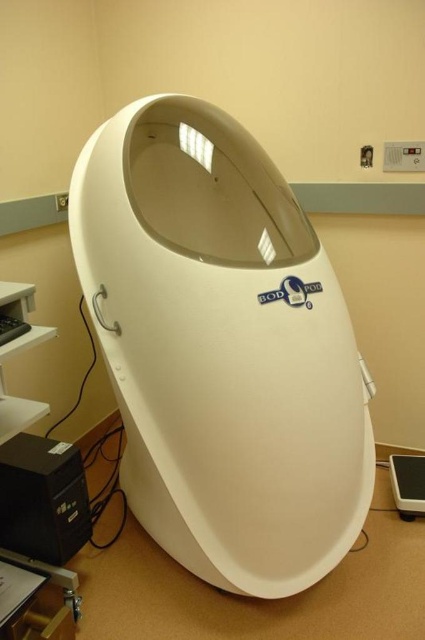
In the scene shown: You are a technician in a lab who needs to move a cable from the black plastic tower at lower left to the white plastic scale at lower right. The cable you have is 1.2 meters long. Will it be long enough to connect them without any extension?

The distance between the black plastic tower at lower left and the white plastic scale at lower right is 1.27 meters. The cable is only 1.2 meters long, so it will be 0.07 meters too short and cannot reach without extension.

From the picture: You are setting up a medical equipment display in a lab. You have a white plastic pod at center and a black plastic mouse at lower left. Which object has a greater width?

The white plastic pod at center has a greater width than the black plastic mouse at lower left.

You are a researcher in a lab and need to access both the white plastic pod at center and the white plastic scale at lower right. Which object will you have to move closer to reach first?

The white plastic pod at center is closer to the viewer than the white plastic scale at lower right, so you will have to reach the white plastic pod at center first before the white plastic scale at lower right.